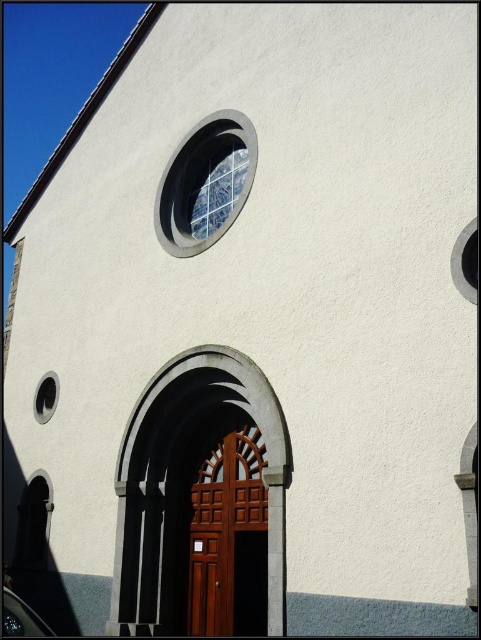
You are standing in front of the building and want to locate the clear glass window at upper center. Which direction should you look relative to the transparent glass window at lower left?

The clear glass window at upper center is to the right of the transparent glass window at lower left, so you should look to the right of the transparent glass window at lower left to find it.

You are standing outside the building and want to enter through the entrance. Which object should you approach first, the polished wood door at center or the transparent glass window at lower left?

The polished wood door at center is in front of the transparent glass window at lower left, so you should approach the polished wood door at center first to enter the building.